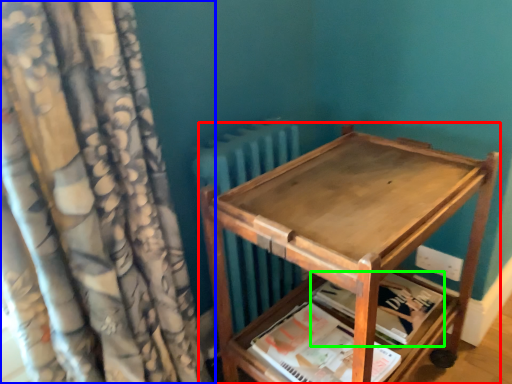
Question: Which object is positioned farthest from furniture (highlighted by a red box)? Select from curtain (highlighted by a blue box) and paperback book (highlighted by a green box).

Choices:
 (A) curtain
 (B) paperback book

Answer: (A)